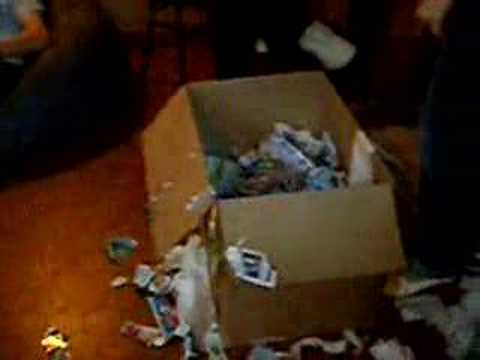
Identify the location of cardboard box. This screenshot has width=480, height=360. (171, 187).